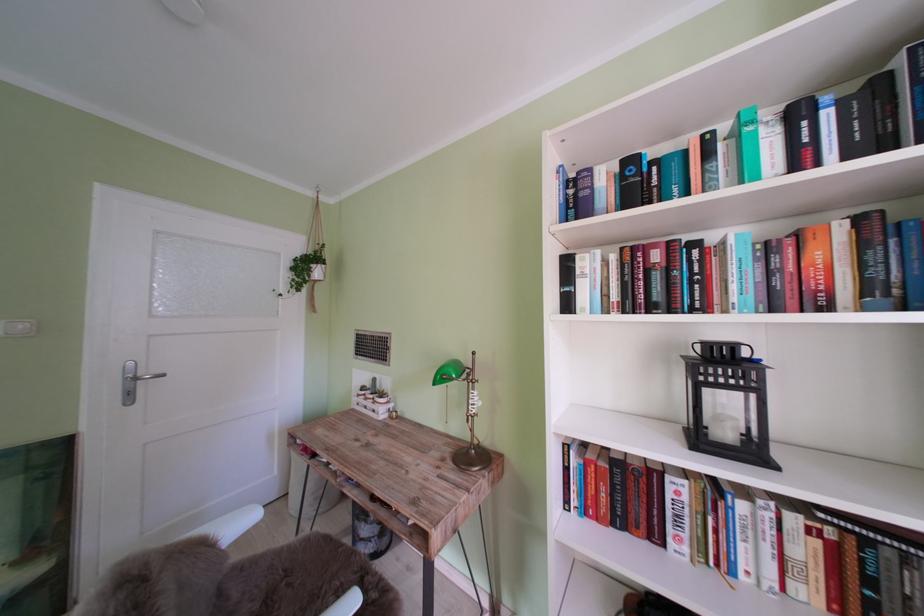
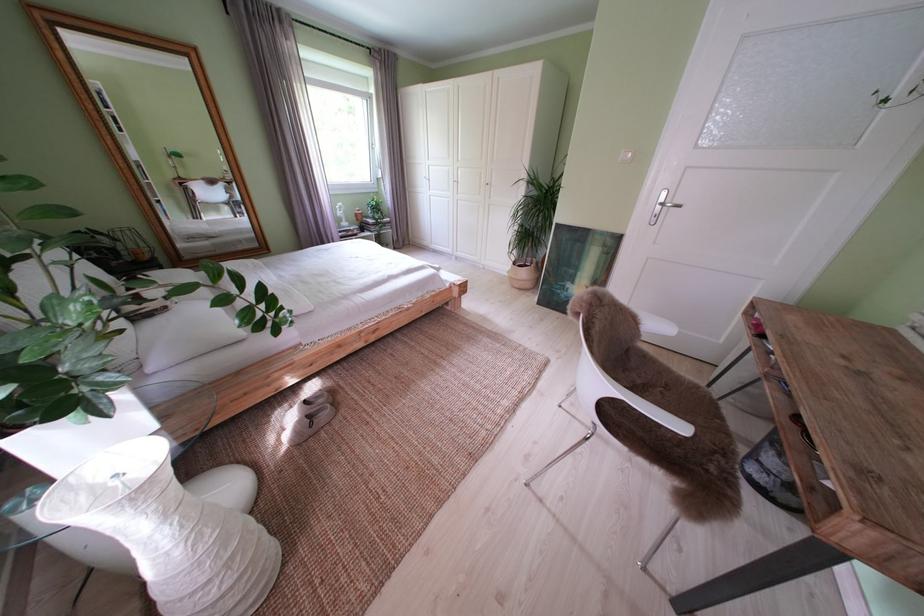
The first image is from the beginning of the video and the second image is from the end. How did the camera likely rotate when shooting the video?

The camera rotated toward left-down.